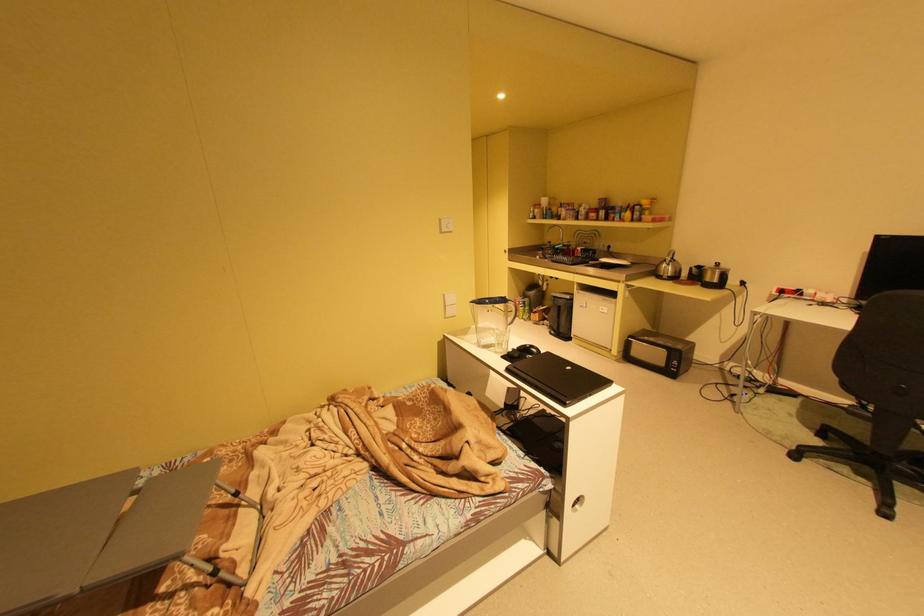
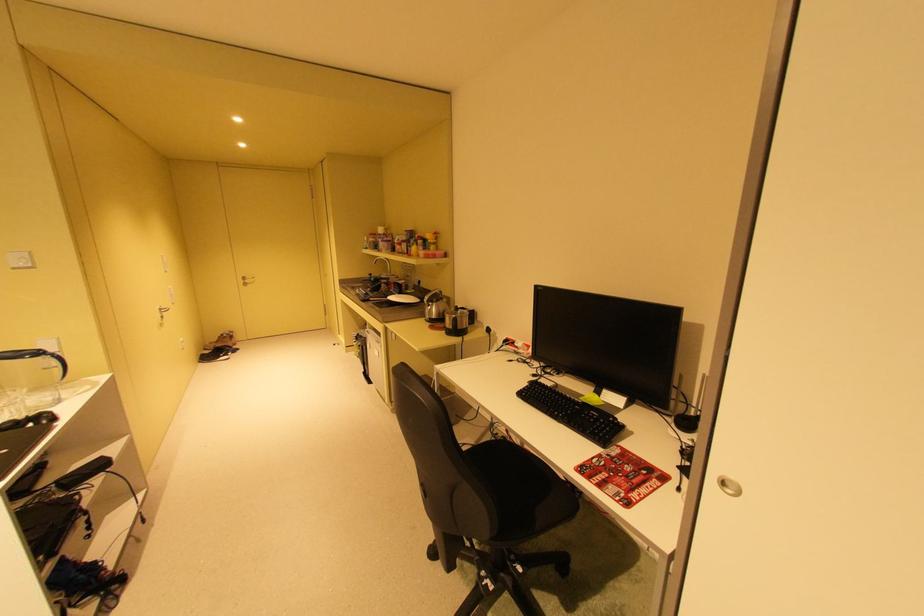
The point at (677, 261) is marked in the first image. Where is the corresponding point in the second image?

(439, 302)